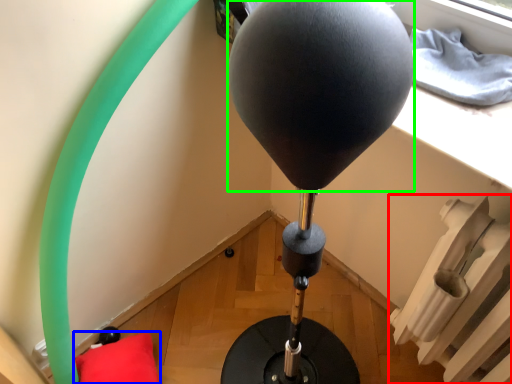
Question: Estimate the real-world distances between objects in this image. Which object is closer to radiator (highlighted by a red box), pillow (highlighted by a blue box) or balloon (highlighted by a green box)?

Choices:
 (A) pillow
 (B) balloon

Answer: (B)